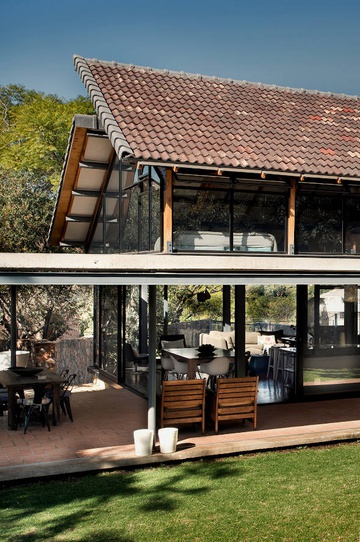
Find the location of a particular element. The height and width of the screenshot is (542, 360). trash can is located at coordinates (144, 443), (163, 443).